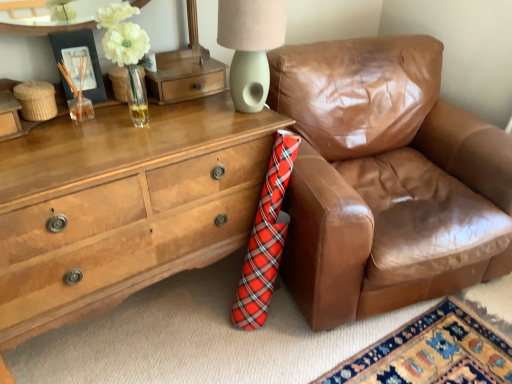
Measure the distance between matte black picture frame at upper left and camera.

matte black picture frame at upper left and camera are 1.30 meters apart.

You are a GUI agent. You are given a task and a screenshot of the screen. Output one action in this format:
    pyautogui.click(x=<x>, y=<y>)
    Task: Click on the brown leather chair at right
    The width and height of the screenshot is (512, 384).
    Given the screenshot: What is the action you would take?
    pyautogui.click(x=386, y=180)

What do you see at coordinates (250, 46) in the screenshot? This screenshot has width=512, height=384. I see `matte green ceramic lampshade at upper center` at bounding box center [250, 46].

This screenshot has width=512, height=384. What are the coordinates of `wooden chest of drawers at lower left` in the screenshot? It's located at (123, 206).

Is matte black picture frame at upper left inside the boundaries of brown leather chair at right, or outside?

matte black picture frame at upper left is not inside brown leather chair at right, it's outside.

Does matte black picture frame at upper left touch brown leather chair at right?

matte black picture frame at upper left and brown leather chair at right are clearly separated.

From a real-world perspective, between matte black picture frame at upper left and brown leather chair at right, who is vertically higher?

In real-world perspective, matte black picture frame at upper left is above.

In the scene shown: From the image's perspective, is matte black picture frame at upper left on top of brown leather chair at right?

Indeed, from the image's perspective, matte black picture frame at upper left is shown above brown leather chair at right.

Does brown leather chair at right have a greater width compared to wooden chest of drawers at lower left?

Yes, brown leather chair at right is wider than wooden chest of drawers at lower left.

Based on their sizes in the image, would you say brown leather chair at right is bigger or smaller than wooden chest of drawers at lower left?

brown leather chair at right is bigger than wooden chest of drawers at lower left.

The height and width of the screenshot is (384, 512). I want to click on chest of drawers located on the left of brown leather chair at right, so coord(123,206).

Do you think brown leather chair at right is within wooden chest of drawers at lower left, or outside of it?

The correct answer is: outside.

In the scene shown: Which object is closer to the camera taking this photo, matte green ceramic lampshade at upper center or wooden chest of drawers at lower left?

wooden chest of drawers at lower left.

How far apart are matte green ceramic lampshade at upper center and wooden chest of drawers at lower left?

matte green ceramic lampshade at upper center and wooden chest of drawers at lower left are 16.24 inches apart.

Could you tell me if matte green ceramic lampshade at upper center is facing wooden chest of drawers at lower left?

No, matte green ceramic lampshade at upper center does not turn towards wooden chest of drawers at lower left.

Who is smaller, matte green ceramic lampshade at upper center or wooden chest of drawers at lower left?

With smaller size is matte green ceramic lampshade at upper center.

From a real-world perspective, does matte green ceramic lampshade at upper center stand above brown leather chair at right?

Yes, from a real-world perspective, matte green ceramic lampshade at upper center is over brown leather chair at right

Is matte green ceramic lampshade at upper center shorter than brown leather chair at right?

Yes, matte green ceramic lampshade at upper center is shorter than brown leather chair at right.

From the image's perspective, is matte green ceramic lampshade at upper center located beneath brown leather chair at right?

Actually, matte green ceramic lampshade at upper center appears above brown leather chair at right in the image.

Is matte green ceramic lampshade at upper center closer to the viewer compared to brown leather chair at right?

That is False.

Is brown leather chair at right beside matte green ceramic lampshade at upper center?

No, brown leather chair at right is not with matte green ceramic lampshade at upper center.

Is point (407, 47) positioned after point (229, 42)?

Yes.

Which is more to the left, brown leather chair at right or matte green ceramic lampshade at upper center?

From the viewer's perspective, matte green ceramic lampshade at upper center appears more on the left side.

Is matte black picture frame at upper left oriented towards wooden chest of drawers at lower left?

No, matte black picture frame at upper left is not oriented towards wooden chest of drawers at lower left.

From the image's perspective, would you say matte black picture frame at upper left is shown under wooden chest of drawers at lower left?

Actually, matte black picture frame at upper left appears above wooden chest of drawers at lower left in the image.

Is matte black picture frame at upper left in front of or behind wooden chest of drawers at lower left in the image?

matte black picture frame at upper left is positioned farther from the viewer than wooden chest of drawers at lower left.

Which is behind, brown leather chair at right or matte black picture frame at upper left?

matte black picture frame at upper left is behind.

Considering the sizes of brown leather chair at right and matte black picture frame at upper left in the image, is brown leather chair at right bigger or smaller than matte black picture frame at upper left?

Considering their sizes, brown leather chair at right takes up more space than matte black picture frame at upper left.

Is point (429, 142) farther from camera compared to point (92, 33)?

That is True.

The width and height of the screenshot is (512, 384). Find the location of `picture frame located above the brown leather chair at right (from a real-world perspective)`. picture frame located above the brown leather chair at right (from a real-world perspective) is located at coordinates (79, 61).

Locate an element on the screen. This screenshot has width=512, height=384. chair behind the wooden chest of drawers at lower left is located at coordinates (386, 180).

Which object lies further to the anchor point brown leather chair at right, matte black picture frame at upper left or matte green ceramic lampshade at upper center?

matte black picture frame at upper left is further to brown leather chair at right.

Estimate the real-world distances between objects in this image. Which object is further from wooden chest of drawers at lower left, matte green ceramic lampshade at upper center or matte black picture frame at upper left?

matte black picture frame at upper left.

Based on their spatial positions, is brown leather chair at right or matte black picture frame at upper left further from matte green ceramic lampshade at upper center?

Among the two, brown leather chair at right is located further to matte green ceramic lampshade at upper center.

Estimate the real-world distances between objects in this image. Which object is closer to matte black picture frame at upper left, brown leather chair at right or wooden chest of drawers at lower left?

wooden chest of drawers at lower left.

When comparing their distances from wooden chest of drawers at lower left, does matte green ceramic lampshade at upper center or brown leather chair at right seem closer?

Based on the image, matte green ceramic lampshade at upper center appears to be nearer to wooden chest of drawers at lower left.

Estimate the real-world distances between objects in this image. Which object is closer to brown leather chair at right, matte black picture frame at upper left or wooden chest of drawers at lower left?

Among the two, wooden chest of drawers at lower left is located nearer to brown leather chair at right.

Consider the image. When comparing their distances from brown leather chair at right, does matte green ceramic lampshade at upper center or wooden chest of drawers at lower left seem further?

Among the two, matte green ceramic lampshade at upper center is located further to brown leather chair at right.

Considering their positions, is wooden chest of drawers at lower left positioned further to brown leather chair at right than matte black picture frame at upper left?

matte black picture frame at upper left lies further to brown leather chair at right than the other object.

This screenshot has width=512, height=384. What are the coordinates of `picture frame between matte green ceramic lampshade at upper center and wooden chest of drawers at lower left from top to bottom` in the screenshot? It's located at (79, 61).

Where is `table lamp between wooden chest of drawers at lower left and brown leather chair at right from left to right`? The height and width of the screenshot is (384, 512). table lamp between wooden chest of drawers at lower left and brown leather chair at right from left to right is located at coordinates (250, 46).

Where is `table lamp situated between matte black picture frame at upper left and brown leather chair at right from left to right`? table lamp situated between matte black picture frame at upper left and brown leather chair at right from left to right is located at coordinates (250, 46).

Find the location of a particular element. The image size is (512, 384). the chest of drawers situated between matte black picture frame at upper left and brown leather chair at right from left to right is located at coordinates (123, 206).